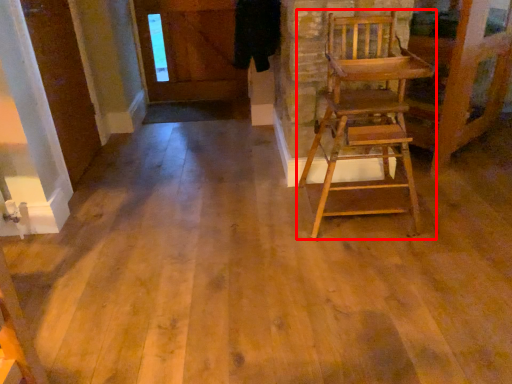
Question: From the image's perspective, where is chair (annotated by the red box) located relative to door?

Choices:
 (A) above
 (B) below

Answer: (B)